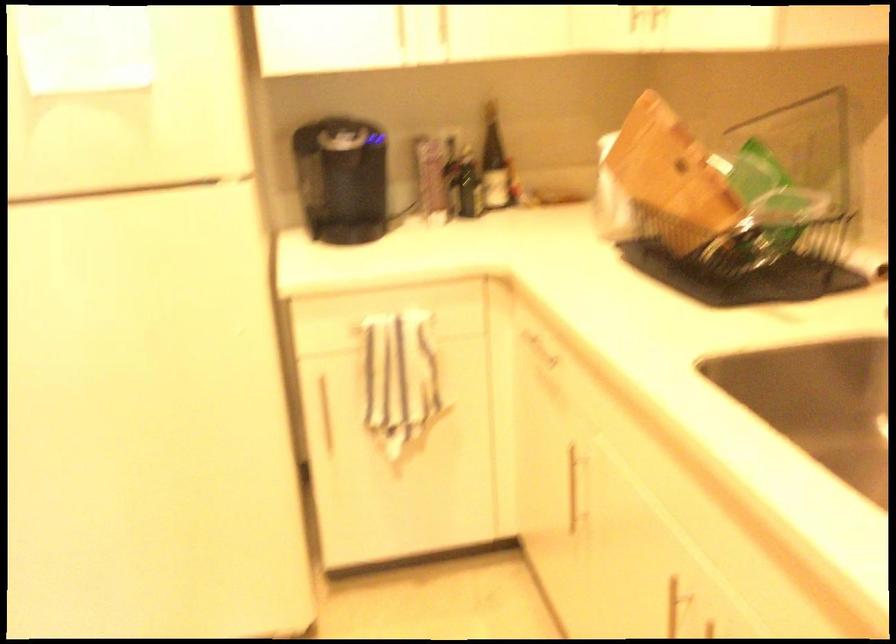
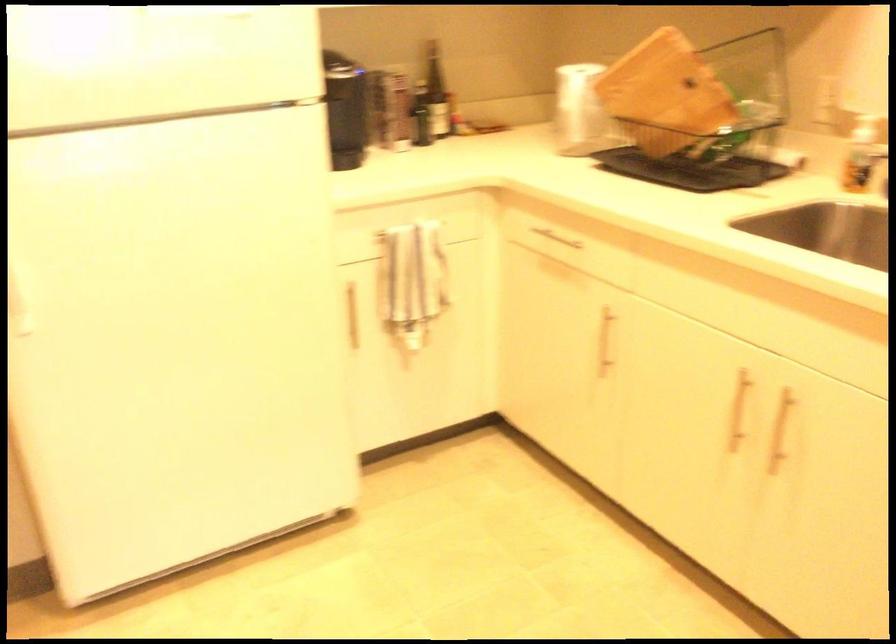
Locate, in the second image, the point that corresponds to point 504,162 in the first image.

(435, 91)